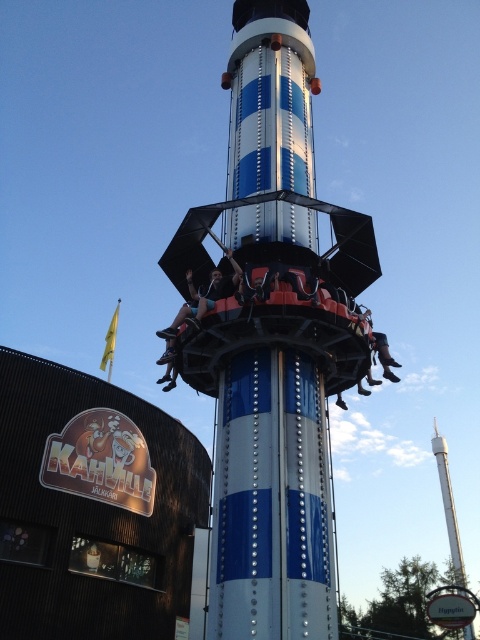
From the picture: You are a maintenance worker needing to inspect the blue polished metal pole at center and the blue metallic tower at center. Which object would you need to check first if you start from the entrance at the front of the ride?

The blue polished metal pole at center is in front of the blue metallic tower at center, so you should check the blue polished metal pole at center first before moving to the blue metallic tower at center.

You are standing at the entrance of the amusement park and see the blue polished metal tower at center. If you walk straight ahead, will the tower be directly in front of you or to the side?

The blue polished metal tower at center is located at point coordinates, so walking straight ahead from the entrance would place the tower directly in front of you since it is centrally positioned.

You are standing at the base of the blue polished metal tower at center and want to see the leather boots at lower right. Can you see them without moving your head?

The blue polished metal tower at center is positioned over leather boots at lower right, so the tower may block your view of the leather boots at lower right unless you move your head or position yourself to the side.